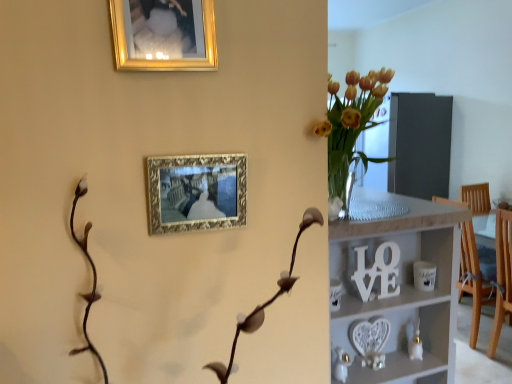
Where is `gold ornate picture frame at upper center, which ranks as the 1th picture frame in bottom-to-top order`? gold ornate picture frame at upper center, which ranks as the 1th picture frame in bottom-to-top order is located at coordinates (196, 192).

Measure the distance between point (x=181, y=22) and camera.

The distance of point (x=181, y=22) from camera is 3.31 feet.

Locate an element on the screen. gold ornate picture frame at upper center, which ranks as the 1th picture frame in bottom-to-top order is located at coordinates (196, 192).

Is gold metallic picture frame at upper center, which is the second picture frame from bottom to top, bigger or smaller than white wooden shelf at center?

gold metallic picture frame at upper center, which is the second picture frame from bottom to top, is smaller than white wooden shelf at center.

Which of these two, gold metallic picture frame at upper center, which is the second picture frame from bottom to top, or white wooden shelf at center, stands shorter?

Standing shorter between the two is gold metallic picture frame at upper center, which is the second picture frame from bottom to top.

Based on the photo, from the image's perspective, which object appears higher, gold metallic picture frame at upper center, the first picture frame in the top-to-bottom sequence, or white wooden shelf at center?

gold metallic picture frame at upper center, the first picture frame in the top-to-bottom sequence, is shown above in the image.

Can you tell me how much gold metallic picture frame at upper center, which is the second picture frame from bottom to top, and white wooden shelf at center differ in facing direction?

The facing directions of gold metallic picture frame at upper center, which is the second picture frame from bottom to top, and white wooden shelf at center are 89.9 degrees apart.

In the scene shown: Is gold ornate picture frame at upper center, which ranks as the 1th picture frame in bottom-to-top order, turned away from gold metallic picture frame at upper center, which is the second picture frame from bottom to top?

gold ornate picture frame at upper center, which ranks as the 1th picture frame in bottom-to-top order, does not have its back to gold metallic picture frame at upper center, which is the second picture frame from bottom to top.

Consider the image. Is gold ornate picture frame at upper center, which ranks as the 1th picture frame in bottom-to-top order, to the left or to the right of gold metallic picture frame at upper center, which is the second picture frame from bottom to top, in the image?

gold ornate picture frame at upper center, which ranks as the 1th picture frame in bottom-to-top order, is positioned on gold metallic picture frame at upper center, which is the second picture frame from bottom to top,'s right side.

From the image's perspective, which is above, gold ornate picture frame at upper center, the second picture frame viewed from the top, or gold metallic picture frame at upper center, the first picture frame in the top-to-bottom sequence?

gold metallic picture frame at upper center, the first picture frame in the top-to-bottom sequence, from the image's perspective.

Consider the image. How different are the orientations of gold ornate picture frame at upper center, the second picture frame viewed from the top, and gold metallic picture frame at upper center, which is the second picture frame from bottom to top, in degrees?

The angular difference between gold ornate picture frame at upper center, the second picture frame viewed from the top, and gold metallic picture frame at upper center, which is the second picture frame from bottom to top, is 0.111 degrees.

Considering the positions of objects gold ornate picture frame at upper center, the second picture frame viewed from the top, and white wooden shelf at center in the image provided, who is behind, gold ornate picture frame at upper center, the second picture frame viewed from the top, or white wooden shelf at center?

white wooden shelf at center is more distant.

From a real-world perspective, is gold ornate picture frame at upper center, the second picture frame viewed from the top, physically located above or below white wooden shelf at center?

gold ornate picture frame at upper center, the second picture frame viewed from the top, is above white wooden shelf at center.

Consider the image. Considering the positions of objects gold ornate picture frame at upper center, which ranks as the 1th picture frame in bottom-to-top order, and white wooden shelf at center in the image provided, who is more to the right, gold ornate picture frame at upper center, which ranks as the 1th picture frame in bottom-to-top order, or white wooden shelf at center?

Positioned to the right is white wooden shelf at center.

How many degrees apart are the facing directions of gold ornate picture frame at upper center, the second picture frame viewed from the top, and white wooden shelf at center?

The facing directions of gold ornate picture frame at upper center, the second picture frame viewed from the top, and white wooden shelf at center are 89.7 degrees apart.

Does gold metallic picture frame at upper center, the first picture frame in the top-to-bottom sequence, lie behind gold ornate picture frame at upper center, the second picture frame viewed from the top?

No, gold metallic picture frame at upper center, the first picture frame in the top-to-bottom sequence, is closer to the viewer.

Is gold metallic picture frame at upper center, which is the second picture frame from bottom to top, taller or shorter than gold ornate picture frame at upper center, the second picture frame viewed from the top?

gold metallic picture frame at upper center, which is the second picture frame from bottom to top, is taller than gold ornate picture frame at upper center, the second picture frame viewed from the top.

Looking at this image, considering the sizes of objects gold metallic picture frame at upper center, which is the second picture frame from bottom to top, and gold ornate picture frame at upper center, the second picture frame viewed from the top, in the image provided, who is bigger, gold metallic picture frame at upper center, which is the second picture frame from bottom to top, or gold ornate picture frame at upper center, the second picture frame viewed from the top,?

With larger size is gold ornate picture frame at upper center, the second picture frame viewed from the top.

Which object is positioned more to the right, gold metallic picture frame at upper center, the first picture frame in the top-to-bottom sequence, or gold ornate picture frame at upper center, which ranks as the 1th picture frame in bottom-to-top order?

gold ornate picture frame at upper center, which ranks as the 1th picture frame in bottom-to-top order, is more to the right.

Is point (374, 244) farther from viewer compared to point (195, 12)?

That is True.

Considering the sizes of white wooden shelf at center and gold metallic picture frame at upper center, which is the second picture frame from bottom to top, in the image, is white wooden shelf at center wider or thinner than gold metallic picture frame at upper center, which is the second picture frame from bottom to top,?

Clearly, white wooden shelf at center has more width compared to gold metallic picture frame at upper center, which is the second picture frame from bottom to top.

From the image's perspective, is white wooden shelf at center above gold metallic picture frame at upper center, the first picture frame in the top-to-bottom sequence?

Actually, white wooden shelf at center appears below gold metallic picture frame at upper center, the first picture frame in the top-to-bottom sequence, in the image.

From the white wooden shelf at center, count 2nd picture frames forward and point to it. Please provide its 2D coordinates.

[(164, 35)]

Is white wooden shelf at center in contact with gold ornate picture frame at upper center, the second picture frame viewed from the top?

→ They are not placed beside each other.

How much distance is there between white wooden shelf at center and gold ornate picture frame at upper center, which ranks as the 1th picture frame in bottom-to-top order?

They are 24.79 inches apart.

From the image's perspective, relative to gold ornate picture frame at upper center, the second picture frame viewed from the top, is white wooden shelf at center above or below?

From the image's perspective, white wooden shelf at center appears below gold ornate picture frame at upper center, the second picture frame viewed from the top.

The image size is (512, 384). Identify the location of shelf behind the gold ornate picture frame at upper center, the second picture frame viewed from the top. (397, 286).

From the white wooden shelf at center, count the 2nd picture frame to the left and point to it. Please provide its 2D coordinates.

[(164, 35)]

The width and height of the screenshot is (512, 384). I want to click on picture frame in front of the gold ornate picture frame at upper center, the second picture frame viewed from the top, so click(164, 35).

When comparing their distances from white wooden shelf at center, does gold ornate picture frame at upper center, which ranks as the 1th picture frame in bottom-to-top order, or gold metallic picture frame at upper center, the first picture frame in the top-to-bottom sequence, seem further?

Among the two, gold metallic picture frame at upper center, the first picture frame in the top-to-bottom sequence, is located further to white wooden shelf at center.

When comparing their distances from gold metallic picture frame at upper center, the first picture frame in the top-to-bottom sequence, does gold ornate picture frame at upper center, which ranks as the 1th picture frame in bottom-to-top order, or white wooden shelf at center seem further?

The object further to gold metallic picture frame at upper center, the first picture frame in the top-to-bottom sequence, is white wooden shelf at center.

When comparing their distances from gold ornate picture frame at upper center, which ranks as the 1th picture frame in bottom-to-top order, does white wooden shelf at center or gold metallic picture frame at upper center, the first picture frame in the top-to-bottom sequence, seem closer?

gold metallic picture frame at upper center, the first picture frame in the top-to-bottom sequence, is positioned closer to the anchor gold ornate picture frame at upper center, which ranks as the 1th picture frame in bottom-to-top order.

Looking at the image, which one is located further to white wooden shelf at center, gold metallic picture frame at upper center, which is the second picture frame from bottom to top, or gold ornate picture frame at upper center, the second picture frame viewed from the top?

Among the two, gold metallic picture frame at upper center, which is the second picture frame from bottom to top, is located further to white wooden shelf at center.

Looking at the image, which one is located closer to gold metallic picture frame at upper center, which is the second picture frame from bottom to top, white wooden shelf at center or gold ornate picture frame at upper center, which ranks as the 1th picture frame in bottom-to-top order?

gold ornate picture frame at upper center, which ranks as the 1th picture frame in bottom-to-top order, is closer to gold metallic picture frame at upper center, which is the second picture frame from bottom to top.

Considering their positions, is gold metallic picture frame at upper center, which is the second picture frame from bottom to top, positioned closer to gold ornate picture frame at upper center, which ranks as the 1th picture frame in bottom-to-top order, than white wooden shelf at center?

Among the two, gold metallic picture frame at upper center, which is the second picture frame from bottom to top, is located nearer to gold ornate picture frame at upper center, which ranks as the 1th picture frame in bottom-to-top order.

Find the location of a particular element. picture frame between gold metallic picture frame at upper center, which is the second picture frame from bottom to top, and white wooden shelf at center vertically is located at coordinates (196, 192).